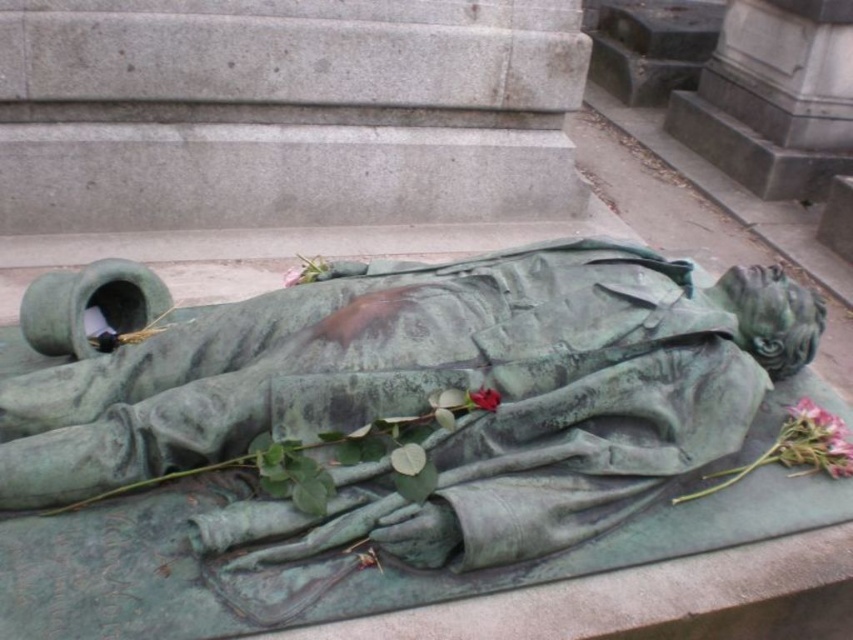
Question: Can you confirm if pink matte rose at lower right is smaller than matte green rose at center?

Choices:
 (A) no
 (B) yes

Answer: (A)

Question: Which point appears closest to the camera in this image?

Choices:
 (A) click(x=471, y=468)
 (B) click(x=495, y=394)

Answer: (A)

Question: Which point appears closest to the camera in this image?

Choices:
 (A) (479, 404)
 (B) (811, 449)

Answer: (A)

Question: Does green patina statue at center appear over pink matte rose at lower right?

Choices:
 (A) yes
 (B) no

Answer: (A)

Question: Which point is closer to the camera?

Choices:
 (A) (479, 392)
 (B) (402, 307)

Answer: (A)

Question: Is green patina statue at center to the left of pink matte rose at lower right from the viewer's perspective?

Choices:
 (A) yes
 (B) no

Answer: (A)